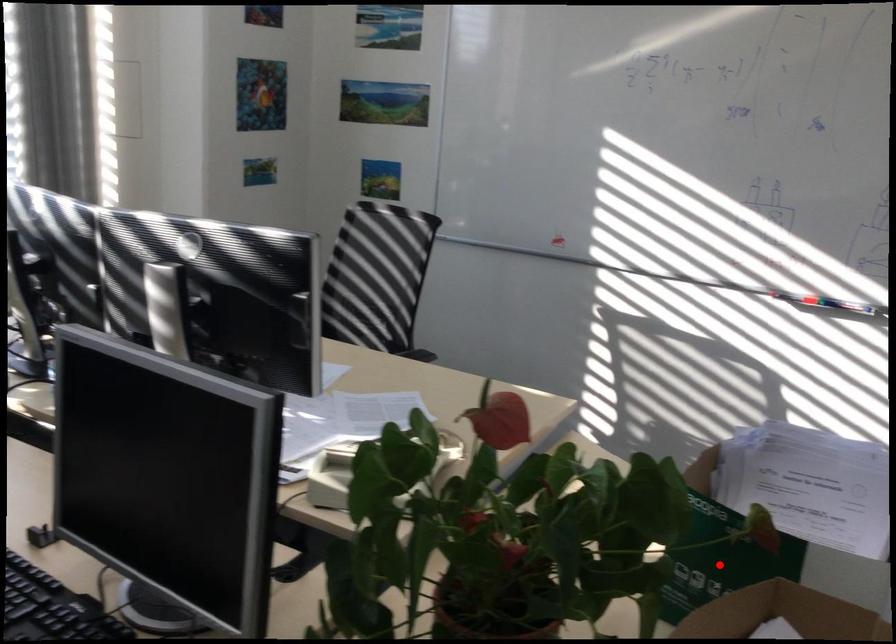
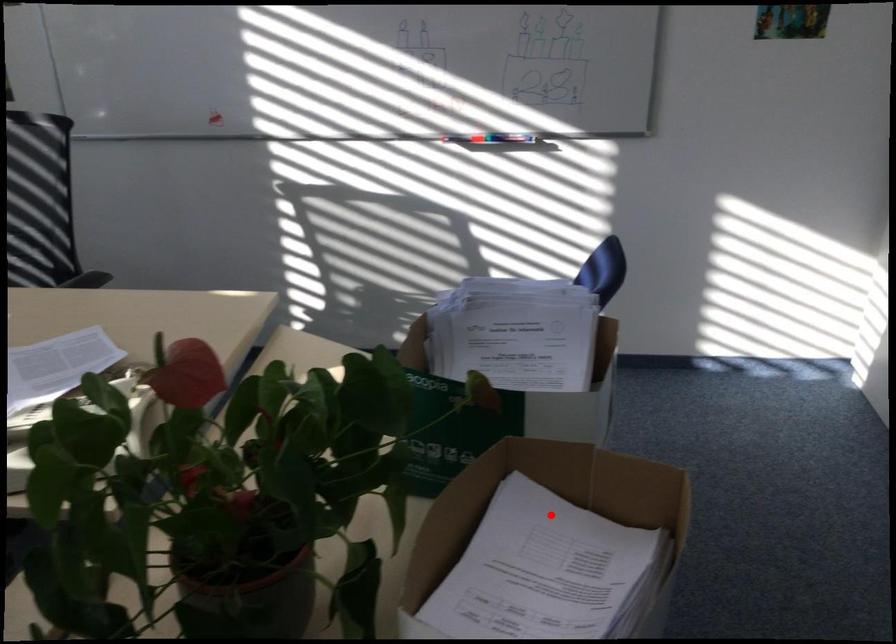
I am providing you with two images of the same scene from different viewpoints. A red point is marked on the first image and another point is marked on the second image. Are the points marked in image1 and image2 representing the same 3D position?

No